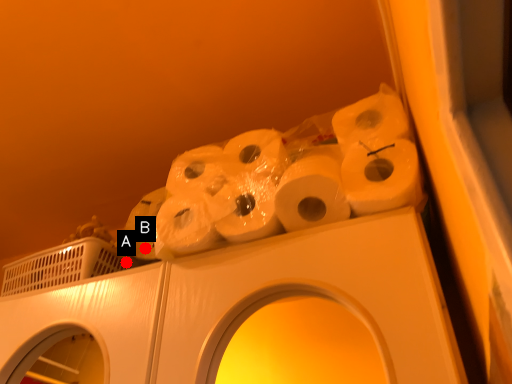
Question: Two points are circled on the image, labeled by A and B beside each circle. Which point is closer to the camera taking this photo?

Choices:
 (A) A is closer
 (B) B is closer

Answer: (B)